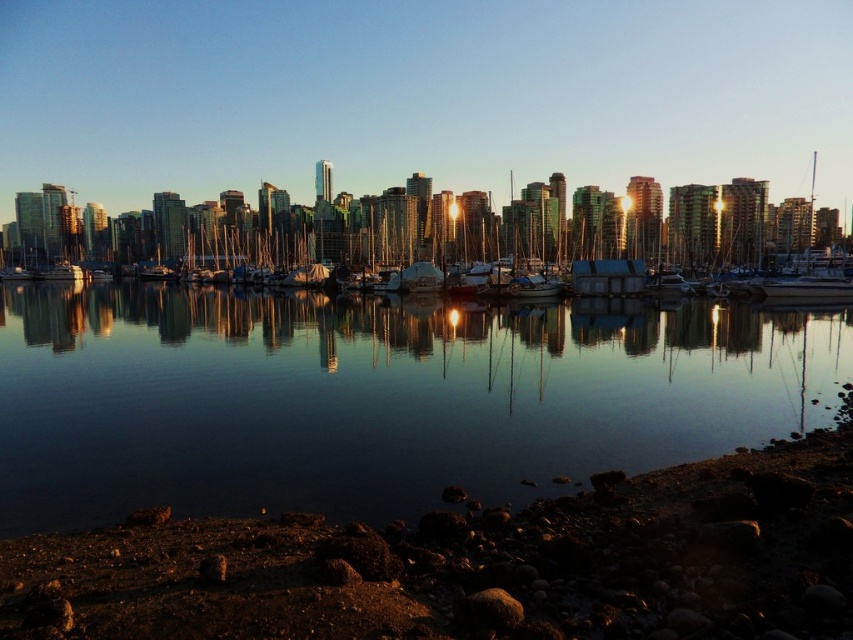
Question: Which point is farther to the camera?

Choices:
 (A) (83, 278)
 (B) (605, 625)
 (C) (113, 298)

Answer: (A)

Question: Which point is closer to the camera taking this photo?

Choices:
 (A) (13, 433)
 (B) (143, 611)
 (C) (70, 269)
 (D) (233, 216)

Answer: (B)

Question: Which of the following is the closest to the observer?

Choices:
 (A) rough stone shore at lower right
 (B) metallic silver boat at left
 (C) transparent glass water at center

Answer: (A)

Question: Is rough stone shore at lower right below metallic silver boat at left?

Choices:
 (A) no
 (B) yes

Answer: (B)

Question: Is rough stone shore at lower right above metallic silver sailboat at center?

Choices:
 (A) yes
 (B) no

Answer: (B)

Question: From the image, what is the correct spatial relationship of transparent glass water at center in relation to rough stone shore at lower right?

Choices:
 (A) above
 (B) below

Answer: (A)